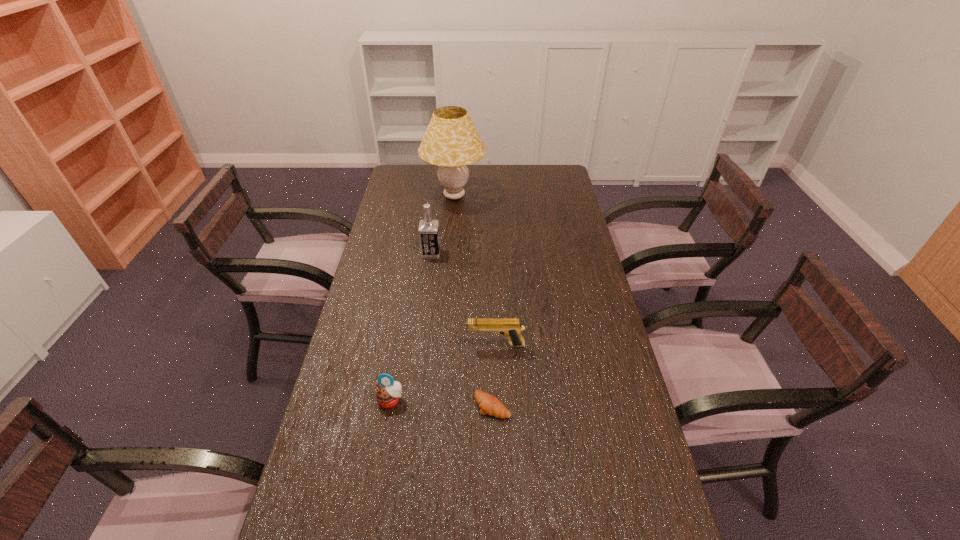
Locate an element on the screen. The height and width of the screenshot is (540, 960). free location located 0.090m at the barrel of the third nearest object is located at coordinates (438, 345).

Where is `free space located 0.070m at the barrel of the third nearest object`? The width and height of the screenshot is (960, 540). free space located 0.070m at the barrel of the third nearest object is located at coordinates (444, 345).

Where is `free space located 0.300m on the front-facing side of the muffin`? This screenshot has width=960, height=540. free space located 0.300m on the front-facing side of the muffin is located at coordinates (369, 531).

At what (x,y) coordinates should I click in order to perform the action: click on free location located on the left of the shortest object. Please return your answer as a coordinate pair (x, y). This screenshot has height=540, width=960. Looking at the image, I should click on (448, 406).

At what (x,y) coordinates should I click in order to perform the action: click on object at the far edge. Please return your answer as a coordinate pair (x, y). The width and height of the screenshot is (960, 540). Looking at the image, I should click on (451, 141).

Identify the location of lampshade positioned at the left edge. (451, 141).

Find the location of a particular element. The image size is (960, 540). muffin that is positioned at the left edge is located at coordinates (388, 393).

Locate an element on the screen. The width and height of the screenshot is (960, 540). object that is at the far left corner is located at coordinates (451, 141).

Locate an element on the screen. This screenshot has width=960, height=540. free space at the far edge of the desktop is located at coordinates (436, 177).

Where is `free region at the left edge`? Image resolution: width=960 pixels, height=540 pixels. free region at the left edge is located at coordinates (339, 416).